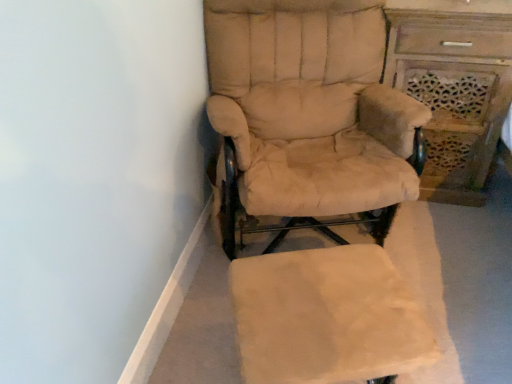
Question: Should I look upward or downward to see beige fabric ottoman at lower center?

Choices:
 (A) down
 (B) up

Answer: (A)

Question: Is beige fabric chair at center smaller than wooden carved vanity at right?

Choices:
 (A) no
 (B) yes

Answer: (A)

Question: From the image's perspective, is beige fabric chair at center above wooden carved vanity at right?

Choices:
 (A) no
 (B) yes

Answer: (A)

Question: Is beige fabric chair at center behind wooden carved vanity at right?

Choices:
 (A) no
 (B) yes

Answer: (A)

Question: Can you see beige fabric chair at center touching wooden carved vanity at right?

Choices:
 (A) yes
 (B) no

Answer: (B)

Question: Can we say beige fabric chair at center lies outside wooden carved vanity at right?

Choices:
 (A) yes
 (B) no

Answer: (A)

Question: From a real-world perspective, is beige fabric chair at center physically below wooden carved vanity at right?

Choices:
 (A) yes
 (B) no

Answer: (B)

Question: Is beige fabric ottoman at lower center taller than beige fabric chair at center?

Choices:
 (A) yes
 (B) no

Answer: (B)

Question: Considering the relative sizes of beige fabric ottoman at lower center and beige fabric chair at center in the image provided, is beige fabric ottoman at lower center shorter than beige fabric chair at center?

Choices:
 (A) no
 (B) yes

Answer: (B)

Question: From the image's perspective, would you say beige fabric ottoman at lower center is shown under beige fabric chair at center?

Choices:
 (A) no
 (B) yes

Answer: (B)

Question: Is beige fabric ottoman at lower center positioned before beige fabric chair at center?

Choices:
 (A) yes
 (B) no

Answer: (A)

Question: Does beige fabric ottoman at lower center have a larger size compared to beige fabric chair at center?

Choices:
 (A) no
 (B) yes

Answer: (A)

Question: Can you see beige fabric ottoman at lower center touching beige fabric chair at center?

Choices:
 (A) no
 (B) yes

Answer: (A)

Question: Is beige fabric chair at center turned away from beige fabric ottoman at lower center?

Choices:
 (A) yes
 (B) no

Answer: (B)